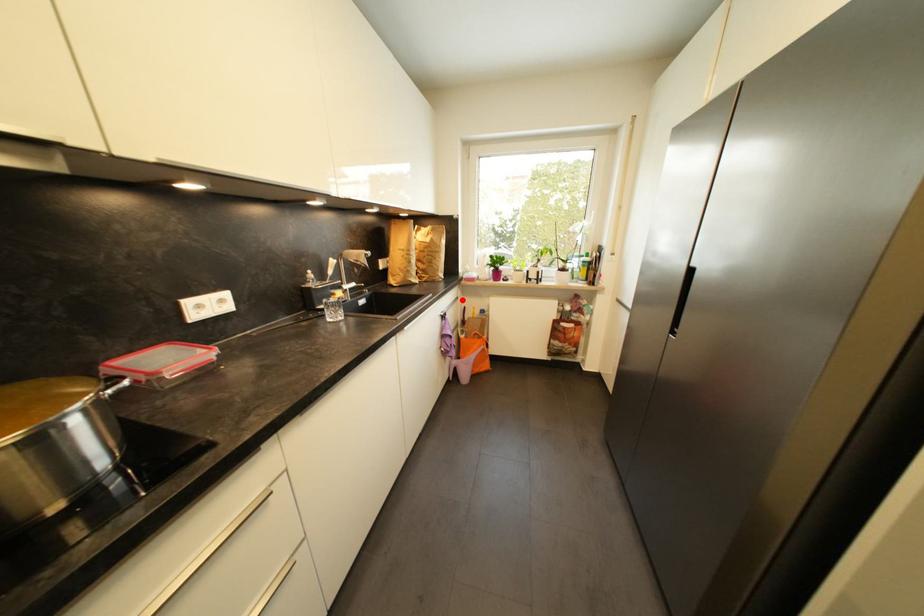
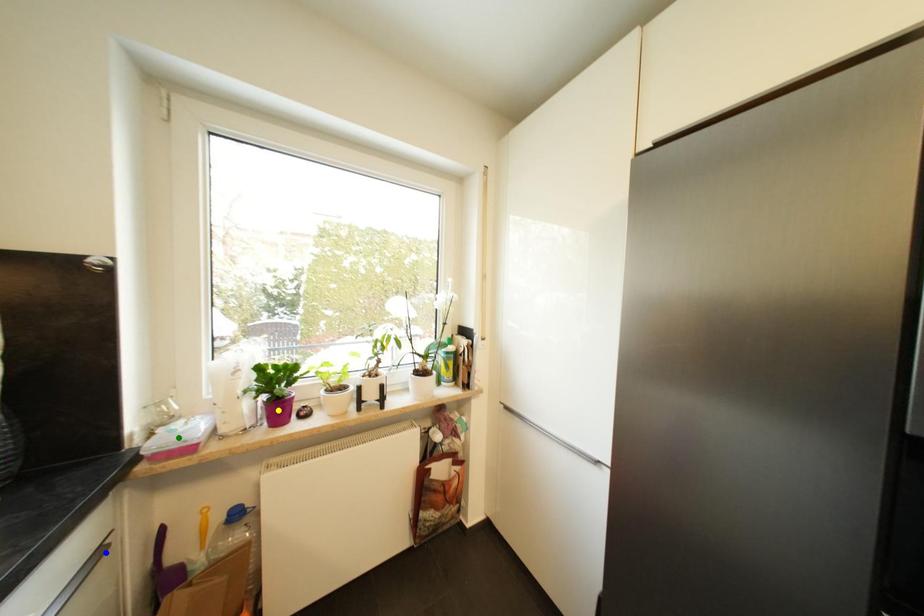
Question: I am providing you with two images of the same scene from different viewpoints. A red point is marked on the first image. You are given multiple points on the second image. Which spot in image 2 lines up with the point in image 1?

Choices:
 (A) blue point
 (B) yellow point
 (C) green point

Answer: (A)